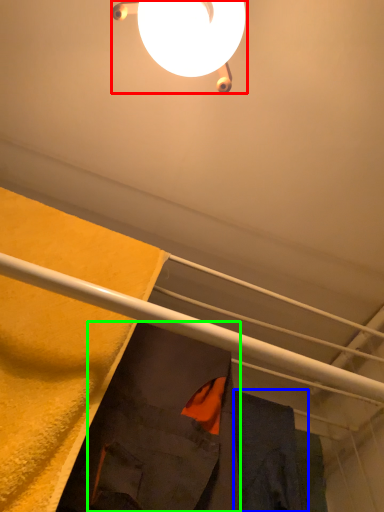
Question: Which object is the farthest from lamp (highlighted by a red box)? Choose among these: robe (highlighted by a blue box) or robe (highlighted by a green box).

Choices:
 (A) robe
 (B) robe

Answer: (A)